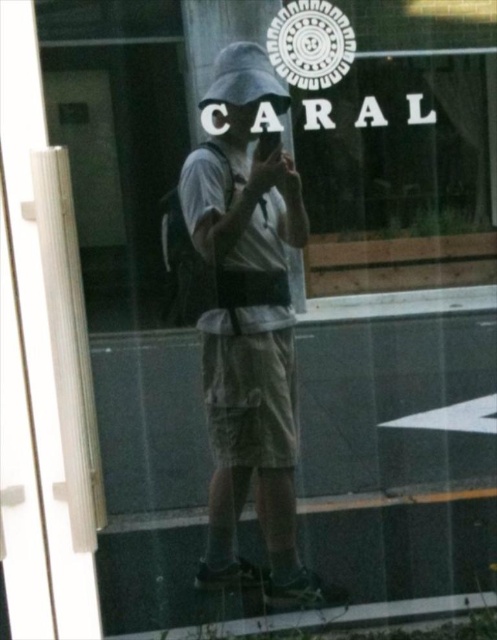
Can you confirm if khaki cotton shorts at center is smaller than dark gray matte baseball hat at upper center?

Incorrect, khaki cotton shorts at center is not smaller in size than dark gray matte baseball hat at upper center.

Does point (264, 428) lie behind point (241, 68)?

Yes, it is.

Between point (228, 49) and point (206, 92), which one is positioned in front?

Point (228, 49) is more forward.

The width and height of the screenshot is (497, 640). I want to click on khaki cotton shorts at center, so click(x=246, y=323).